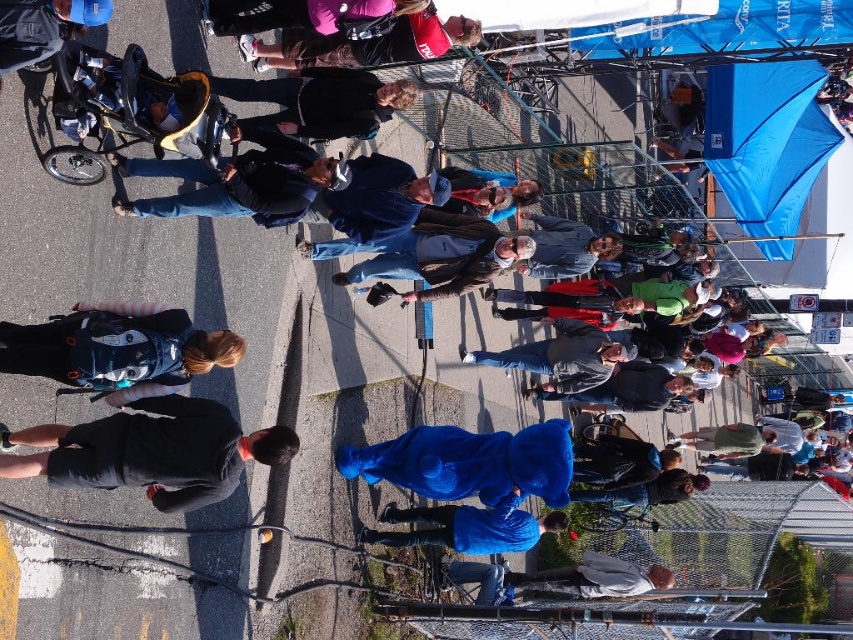
Can you confirm if matte blue backpack at left is shorter than black plastic baby carriage at upper left?

Yes.

Who is more forward, (12,362) or (202,86)?

Point (12,362)

Who is more forward, [166,364] or [102,84]?

Point [166,364] is in front.

The image size is (853, 640). I want to click on matte blue backpack at left, so click(117, 348).

I want to click on matte blue backpack at left, so click(117, 348).

Which is behind, point (62, 323) or point (558, 518)?

The point (558, 518) is behind.

The width and height of the screenshot is (853, 640). I want to click on matte blue backpack at left, so click(x=117, y=348).

Who is positioned more to the right, matte pink jacket at upper center or blue fleece jacket at lower center?

blue fleece jacket at lower center is more to the right.

Is matte pink jacket at upper center below blue fleece jacket at lower center?

Incorrect, matte pink jacket at upper center is not positioned below blue fleece jacket at lower center.

Find the location of a particular element. This screenshot has height=640, width=853. matte pink jacket at upper center is located at coordinates (368, 44).